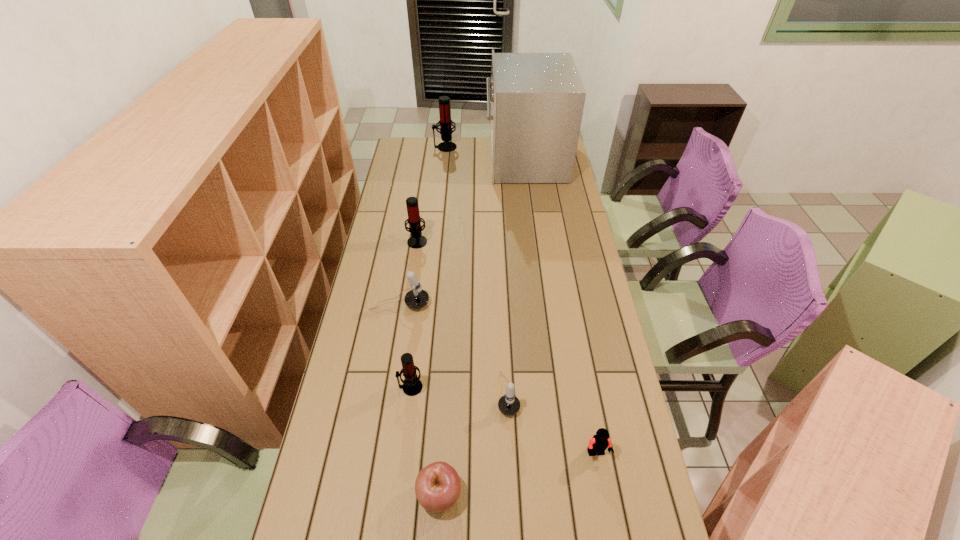
Where is `free space located on the front of the nearest red microphone`? free space located on the front of the nearest red microphone is located at coordinates (392, 536).

Locate an element on the screen. vacant space located on the back of the right white microphone is located at coordinates (503, 290).

The height and width of the screenshot is (540, 960). I want to click on vacant space located on the front-facing side of the second nearest object, so click(603, 489).

Identify the location of vacant space located 0.340m on the side of the nearest object with the unique marking. (592, 494).

Identify the location of toaster oven at the far edge. Image resolution: width=960 pixels, height=540 pixels. (537, 99).

What are the coordinates of `microphone at the far edge` in the screenshot? It's located at (445, 121).

Identify the location of toaster oven at the right edge. The width and height of the screenshot is (960, 540). (537, 99).

What are the coordinates of `Lego present at the right edge` in the screenshot? It's located at (600, 442).

Locate an element on the screen. This screenshot has height=540, width=960. object that is at the far right corner is located at coordinates (537, 99).

Locate an element on the screen. This screenshot has width=960, height=540. free location at the left edge of the desktop is located at coordinates (396, 183).